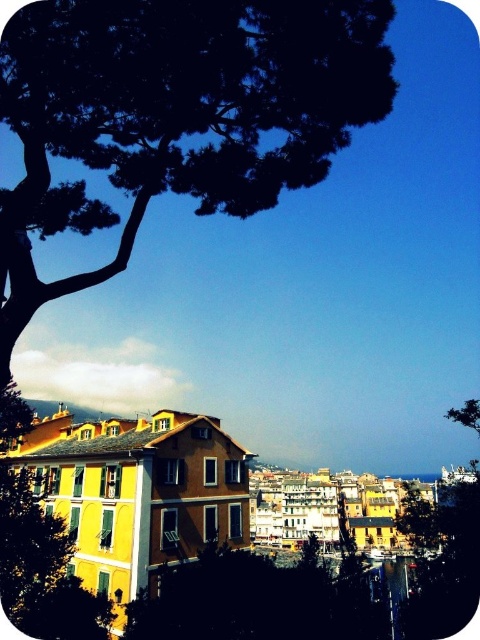
Who is higher up, dark green textured tree at upper left or green matte tree at upper left?

dark green textured tree at upper left

Between dark green textured tree at upper left and green matte tree at upper left, which one is positioned lower?

green matte tree at upper left is lower down.

Is point (28, 136) behind point (144, 628)?

No.

You are a GUI agent. You are given a task and a screenshot of the screen. Output one action in this format:
    pyautogui.click(x=<x>, y=<y>)
    Task: Click on the dark green textured tree at upper left
    The width and height of the screenshot is (480, 640).
    Given the screenshot: What is the action you would take?
    pyautogui.click(x=175, y=113)